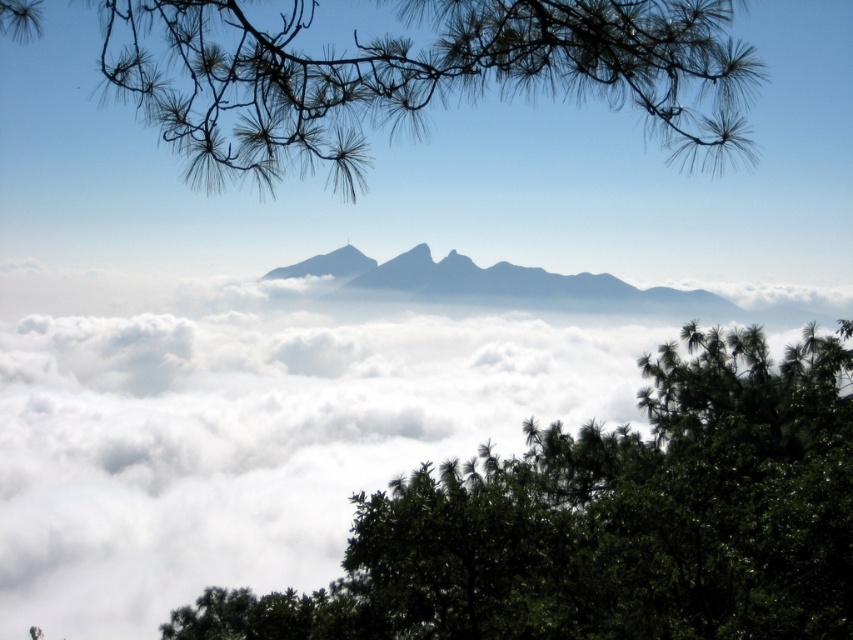
Question: Which point appears farthest from the camera in this image?

Choices:
 (A) (332, 273)
 (B) (735, 54)
 (C) (556, 307)
 (D) (782, 625)

Answer: (A)

Question: Which is nearer to the blue foggy mountain at center?

Choices:
 (A) gray rocky peak at center
 (B) dark green leafy tree at center

Answer: (A)

Question: Does dark green leafy tree at center appear on the left side of gray rocky peak at center?

Choices:
 (A) no
 (B) yes

Answer: (A)

Question: Is blue foggy mountain at center above gray rocky peak at center?

Choices:
 (A) yes
 (B) no

Answer: (B)

Question: Which point is closer to the camera?

Choices:
 (A) (782, 312)
 (B) (689, 36)

Answer: (B)

Question: Observing the image, what is the correct spatial positioning of dark green leafy tree at center in reference to green needle-like branches at upper left?

Choices:
 (A) below
 (B) above

Answer: (A)